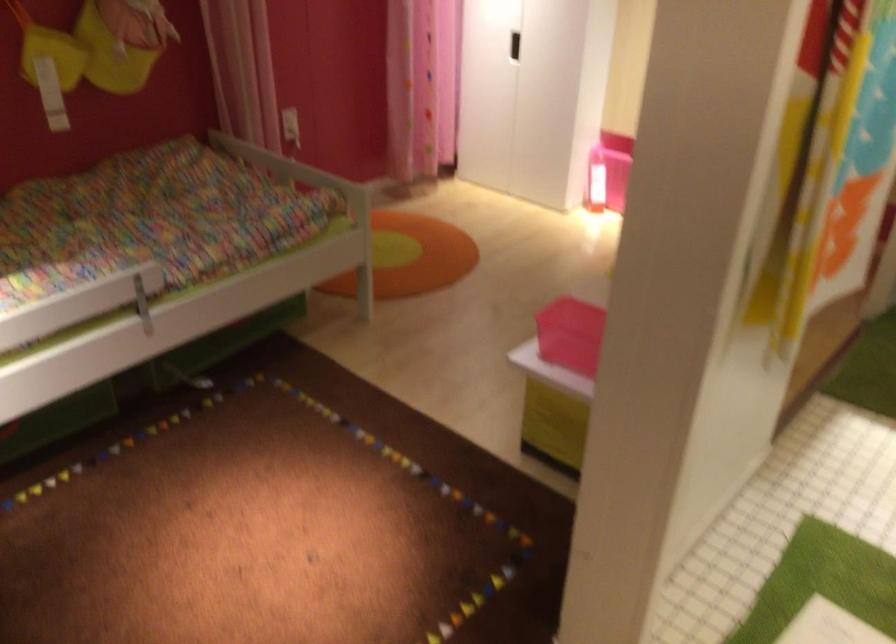
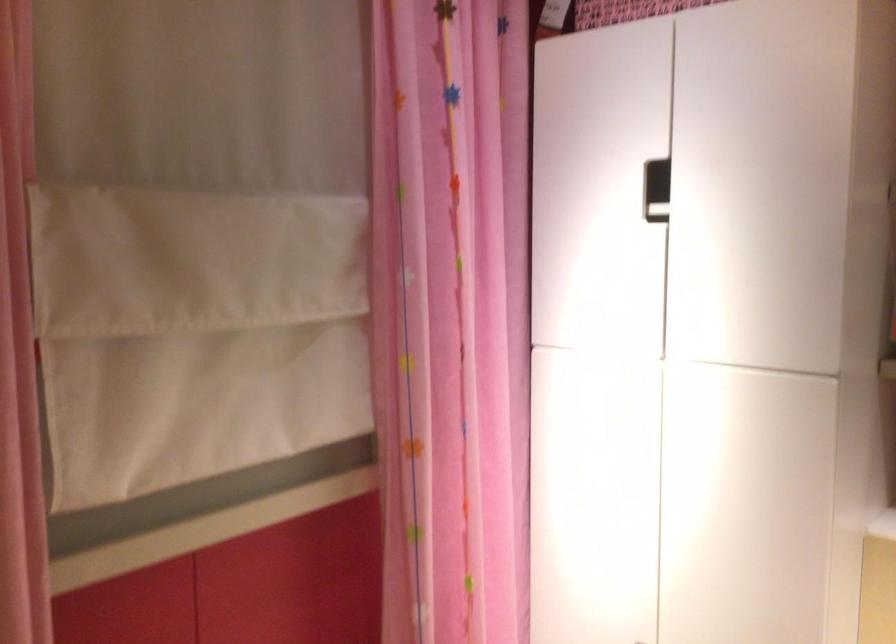
Question: Which direction would the cameraman need to move to produce the second image? Reply with the corresponding letter.

Choices:
 (A) Left
 (B) Right
 (C) Forward
 (D) Backward

Answer: (C)